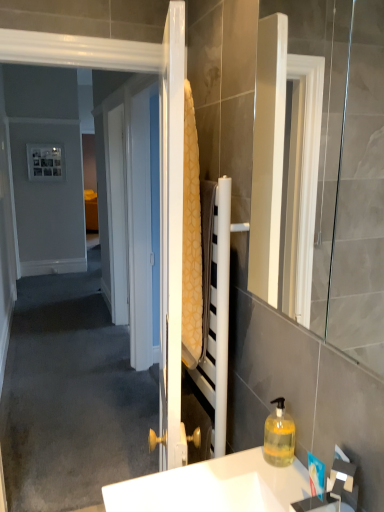
Identify the location of empty space that is ontop of white glossy sink at lower center (from a real-world perspective). The image size is (384, 512). (211, 480).